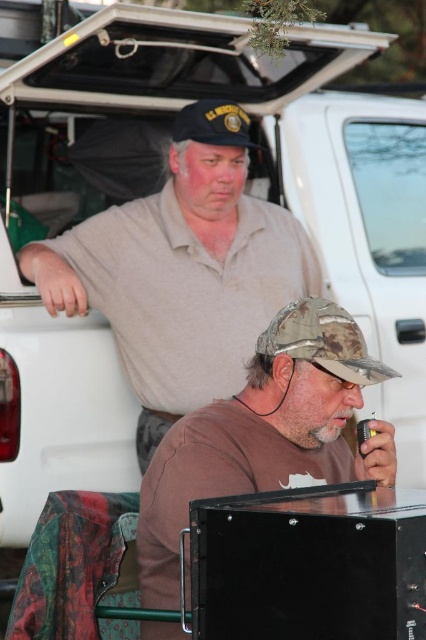
In the scene shown: You are a photographer trying to capture both the light brown cotton shirt at upper center and the brown matte shirt at lower center in a single shot. Which shirt should you focus on first to ensure both are in focus?

You should focus on the light brown cotton shirt at upper center first because it is closer to the viewer than the brown matte shirt at lower center, ensuring both will be in focus when focused on the closer object.

You are a fashion designer analyzing clothing items in an outdoor scene. You observe the light brown cotton shirt at upper center and the brown matte shirt at lower center. Which of these shirts has a wider width according to the scene?

The light brown cotton shirt at upper center has a wider width than the brown matte shirt at lower center.

Based on the scene description, which man is wearing the light brown cotton shirt at upper center and is positioned higher compared to the brown matte shirt at lower center?

The man wearing the light brown cotton shirt at upper center is positioned higher than the brown matte shirt at lower center because the description states that the light brown cotton shirt at upper center is much taller than the brown matte shirt at lower center.